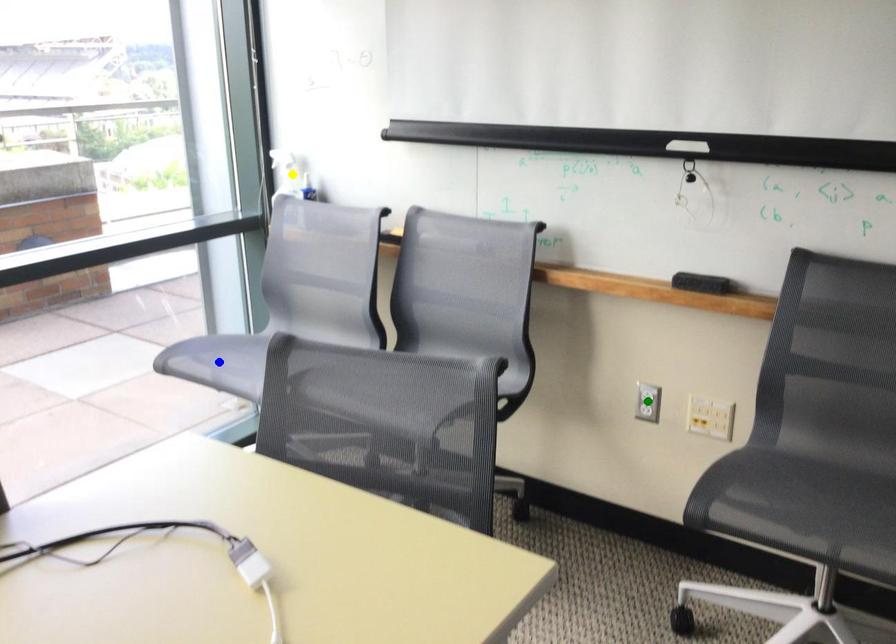
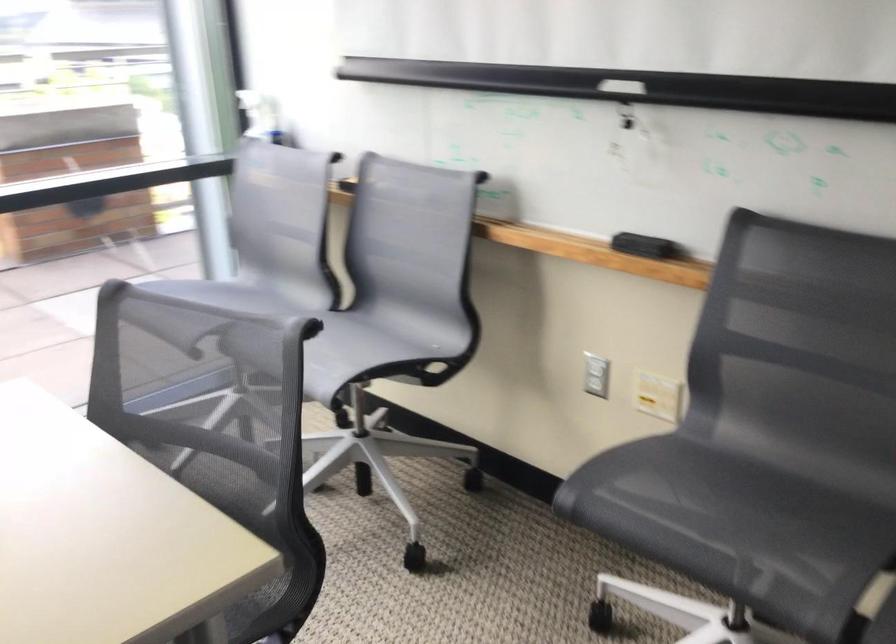
I am providing you with two images of the same scene from different viewpoints. Three points are marked in image1. Which point corresponds to a part or object that is occluded in image2?In image1, three points are marked. Which of them correspond to a part or object that is occluded in image2?Among the three points shown in image1, which one corresponds to a part or object that is no longer visible due to occlusion in image2?

blue point